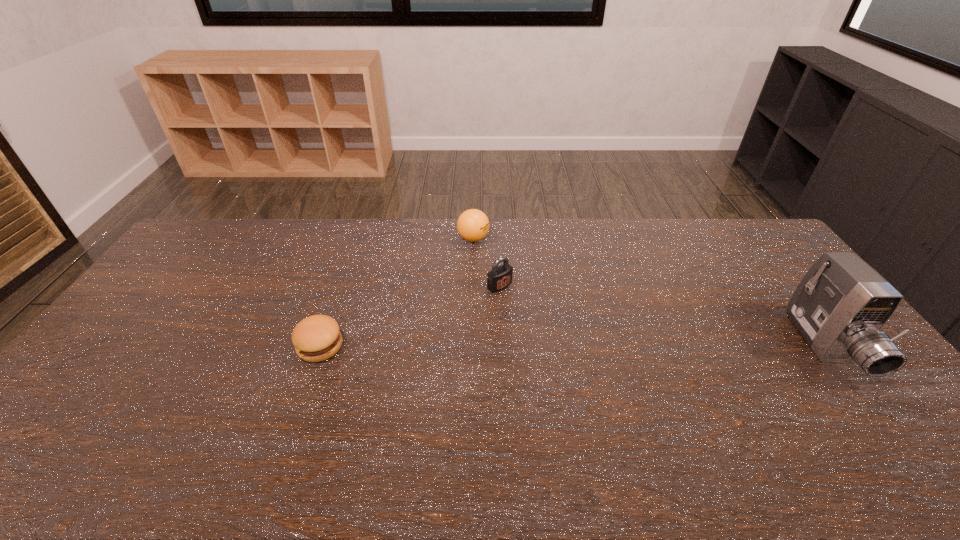
Locate an element on the screen. Image resolution: width=960 pixels, height=540 pixels. empty space between the ping-pong ball and the camcorder is located at coordinates (649, 293).

I want to click on object that is the nearest to the second farthest object, so 473,225.

Locate an element on the screen. The image size is (960, 540). object identified as the second closest to the tallest object is located at coordinates (473, 225).